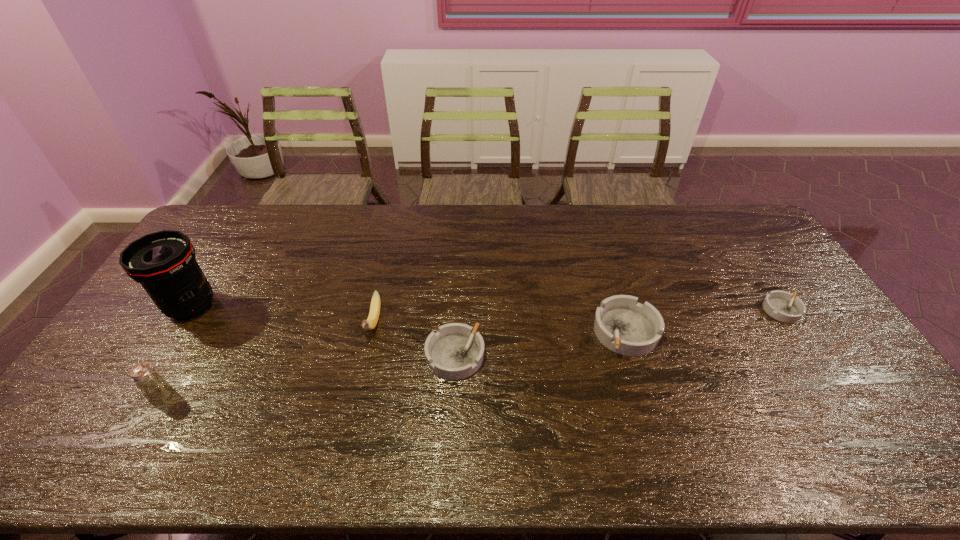
Where is `free space between the fourth object from right to left and the shortest ashtray`? free space between the fourth object from right to left and the shortest ashtray is located at coordinates (578, 316).

The height and width of the screenshot is (540, 960). Identify the location of object that is the third closest to the shortest ashtray. (371, 322).

Choose which object is the second nearest neighbor to the tallest object. Please provide its 2D coordinates. Your answer should be formatted as a tuple, i.e. [(x, y)], where the tuple contains the x and y coordinates of a point satisfying the conditions above.

[(371, 322)]

Find the location of `ashtray that can be found as the second closest to the third object from left to right`. ashtray that can be found as the second closest to the third object from left to right is located at coordinates (623, 325).

Select which ashtray appears as the second closest to the fourth object from right to left. Please provide its 2D coordinates. Your answer should be formatted as a tuple, i.e. [(x, y)], where the tuple contains the x and y coordinates of a point satisfying the conditions above.

[(623, 325)]

Find the location of `free point that satisfies the following two spatial constraints: 1. on the front side of the tallest object; 2. on the left side of the rightmost object`. free point that satisfies the following two spatial constraints: 1. on the front side of the tallest object; 2. on the left side of the rightmost object is located at coordinates (189, 310).

The height and width of the screenshot is (540, 960). Identify the location of blank space that satisfies the following two spatial constraints: 1. on the back side of the nearest object; 2. on the left side of the third object from right to left. (183, 356).

Locate an element on the screen. free region that satisfies the following two spatial constraints: 1. on the back side of the second ashtray from right to left; 2. on the left side of the second tallest object is located at coordinates (198, 332).